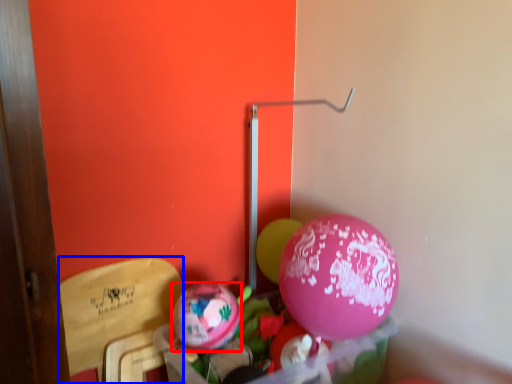
Question: Which point is closer to the camera, balloon (highlighted by a red box) or armchair (highlighted by a blue box)?

Choices:
 (A) balloon
 (B) armchair

Answer: (B)